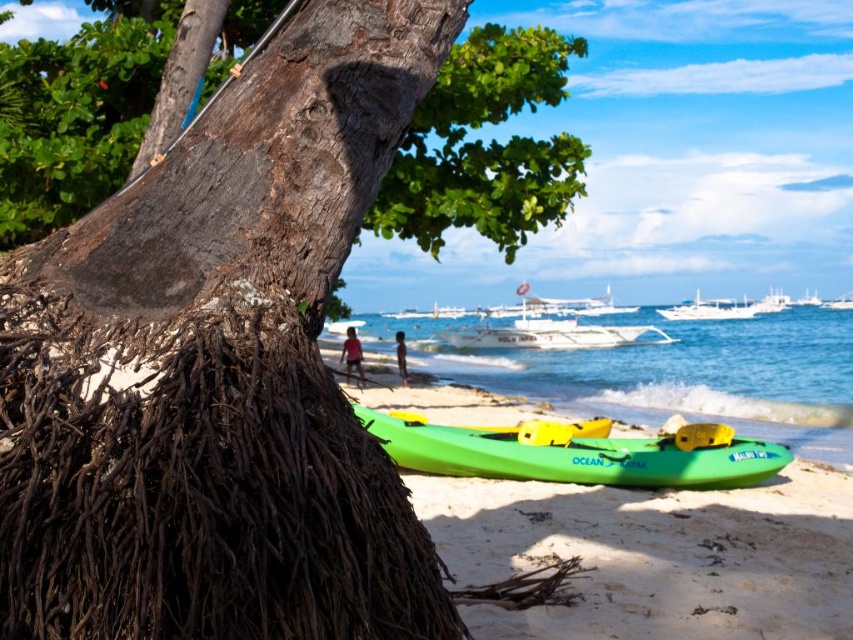
You are standing at the beach and see the brown rough bark tree at center and the white glossy boat at upper center. Which object is positioned to the left of the other?

The brown rough bark tree at center is to the left of the white glossy boat at upper center.

You are standing on the beach and want to take a photo of both the brown rough bark tree at center and the transparent blue water at center. Which object should you focus on first to ensure both are in clear view?

You should focus on the brown rough bark tree at center first since it is closer to you than the transparent blue water at center. By focusing on the closer object, both will be in clear view as the background water will naturally be in focus once the foreground tree is sharp.